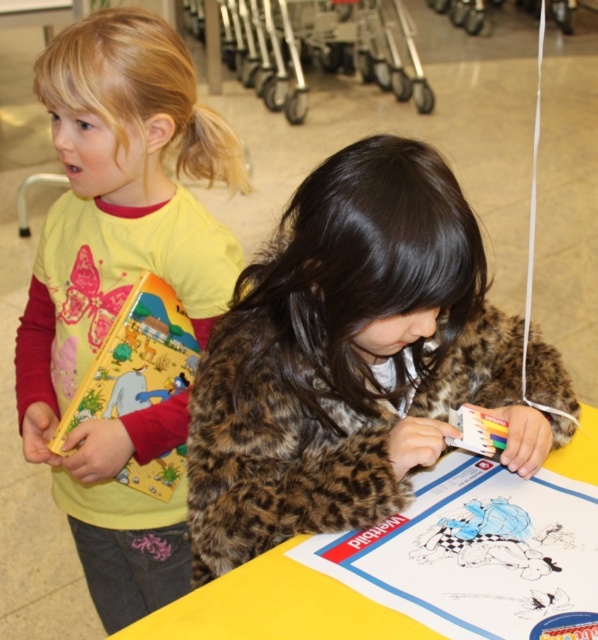
You are a photographer standing 30 inches away from the leopard print jacket at center. Can you safely take a photo without moving closer?

The leopard print jacket at center and viewer are 32.29 inches apart. Since you are standing 30 inches away, you are closer than the stated distance, so you need to move back to ensure you are at least 32.29 inches away to comply with the given measurement.

You are standing at the center of the scene. Which of the two points, point [373,296] or point [175,637], is closer to you?

Point [175,637] is closer to you because point [373,296] is behind point [175,637].